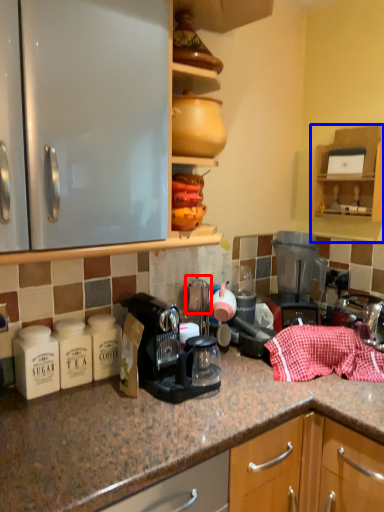
Question: Which object is closer to the camera taking this photo, tea pot (highlighted by a red box) or cabinetry (highlighted by a blue box)?

Choices:
 (A) tea pot
 (B) cabinetry

Answer: (A)